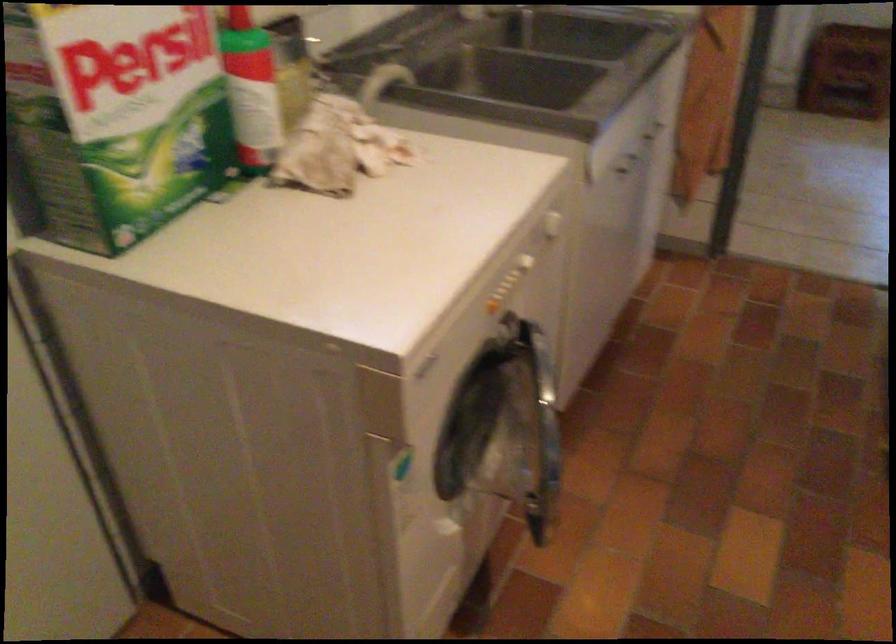
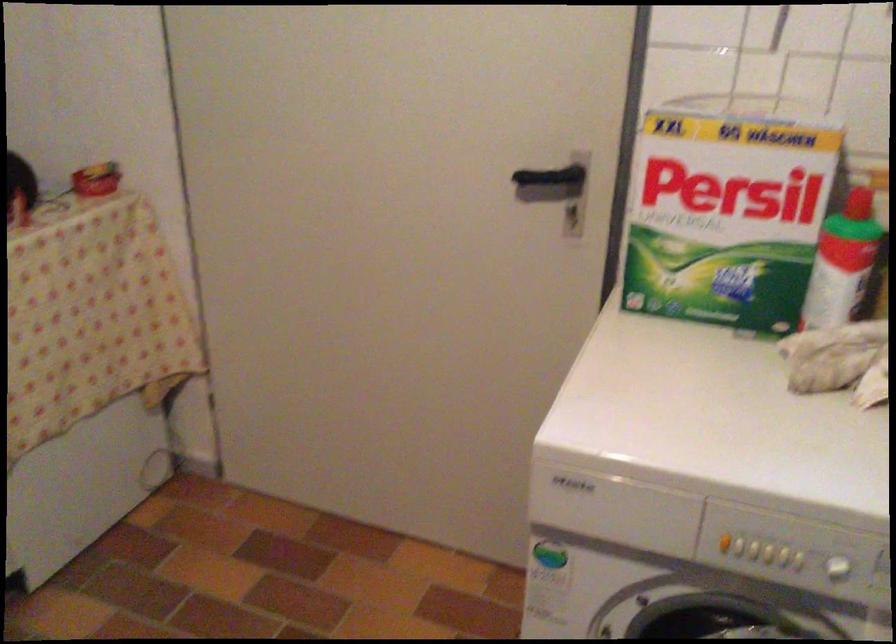
Find the pixel in the second image that matches pixel 487 313 in the first image.

(724, 542)